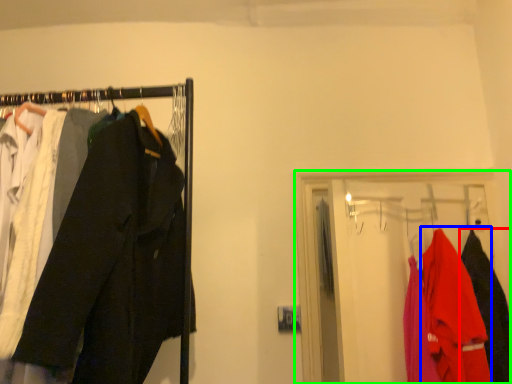
Question: Which object is positioned farthest from clothing (highlighted by a red box)? Select from clothing (highlighted by a blue box) and closet (highlighted by a green box).

Choices:
 (A) clothing
 (B) closet

Answer: (B)